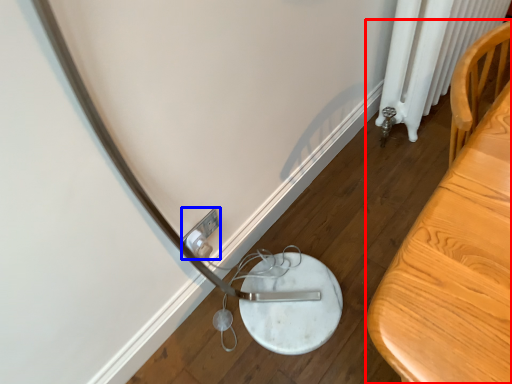
Question: Which of the following is the closest to the observer, furniture (highlighted by a red box) or electric outlet (highlighted by a blue box)?

Choices:
 (A) furniture
 (B) electric outlet

Answer: (A)